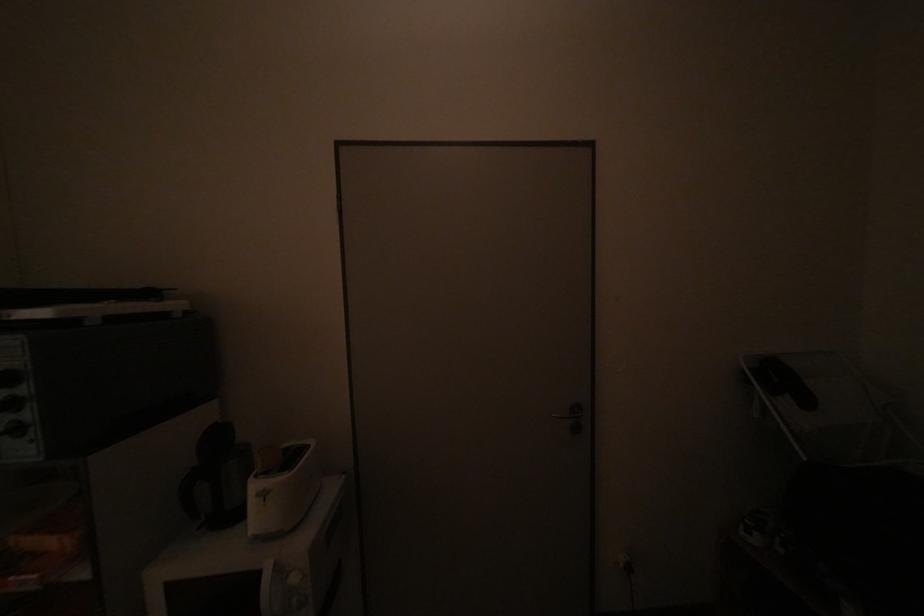
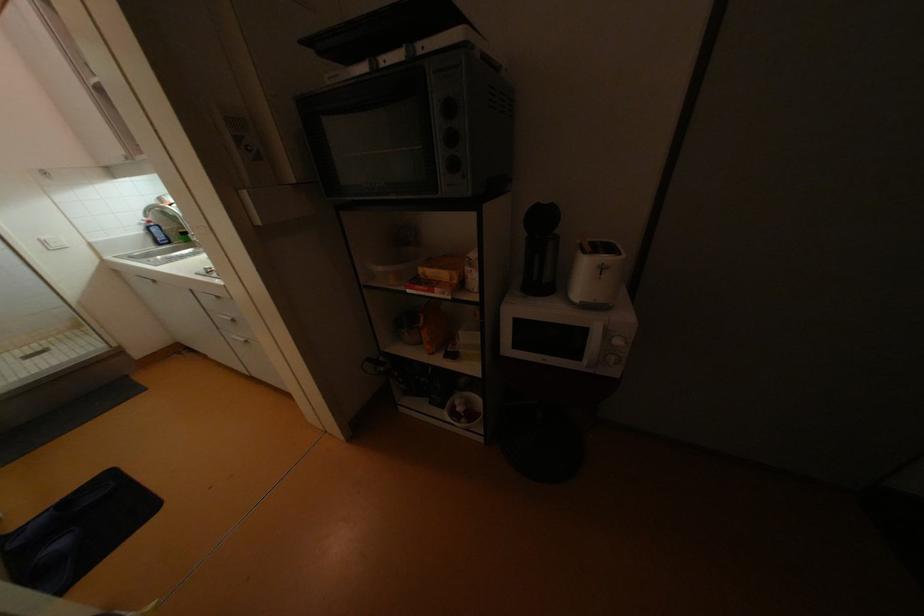
Based on the continuous images, in which direction is the camera rotating?

The camera rotated toward left-down.